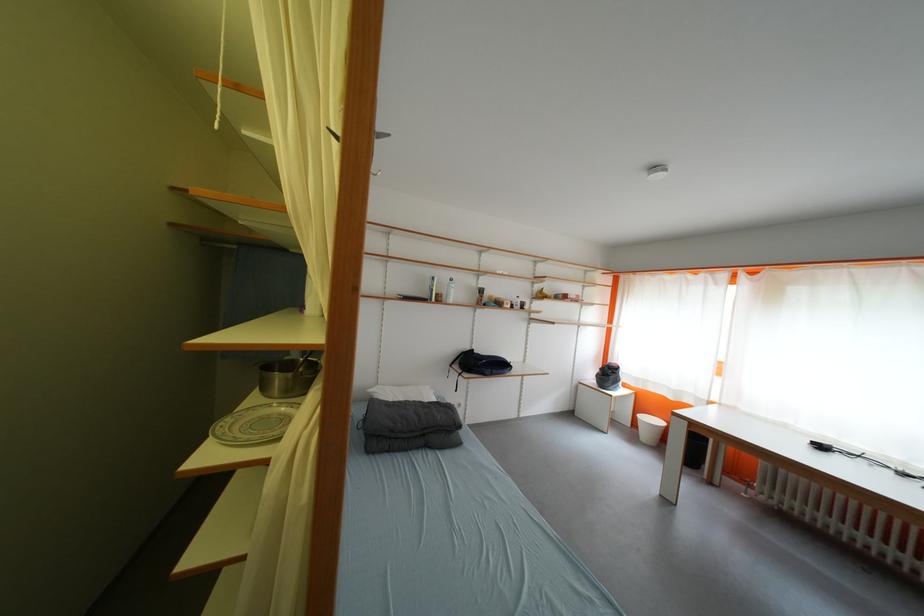
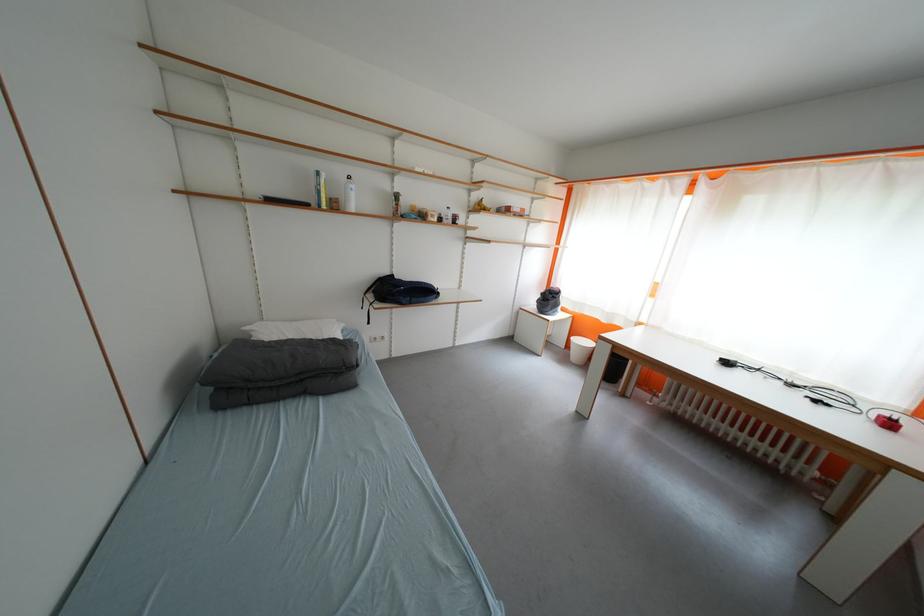
Where in the second image is the point corresponding to point (540, 310) from the first image?

(476, 225)